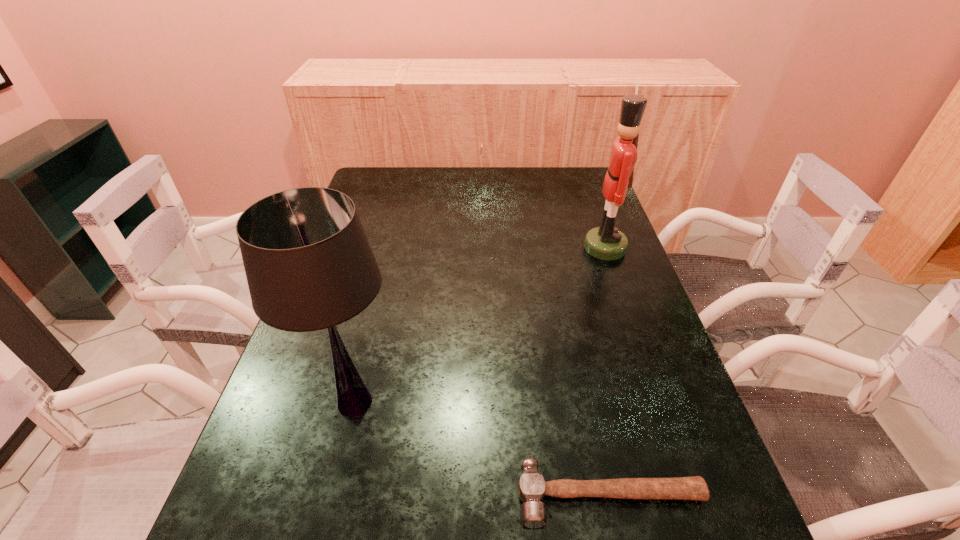
The image size is (960, 540). Identify the location of nutcracker that is at the right edge. (606, 242).

Locate an element on the screen. hammer present at the right edge is located at coordinates (532, 488).

Where is `free space at the far edge of the desktop`? Image resolution: width=960 pixels, height=540 pixels. free space at the far edge of the desktop is located at coordinates (556, 195).

Locate an element on the screen. The width and height of the screenshot is (960, 540). vacant region at the left edge of the desktop is located at coordinates (301, 537).

The width and height of the screenshot is (960, 540). Identify the location of free space at the right edge of the desktop. (623, 435).

In the image, there is a desktop. Identify the location of vacant area at the far right corner. The width and height of the screenshot is (960, 540). (578, 181).

You are a GUI agent. You are given a task and a screenshot of the screen. Output one action in this format:
    pyautogui.click(x=<x>, y=<y>)
    Task: Click on the unoccupied position between the nutcracker and the leftmost object
    This screenshot has width=960, height=540.
    Given the screenshot: What is the action you would take?
    pyautogui.click(x=480, y=325)

Find the location of `free space between the nutcracker and the leftmost object`. free space between the nutcracker and the leftmost object is located at coordinates (480, 325).

In order to click on vacant space in between the farthest object and the second farthest object in this screenshot , I will do `click(480, 325)`.

Where is `vacant point located between the shortest object and the nutcracker`? vacant point located between the shortest object and the nutcracker is located at coordinates pos(608,372).